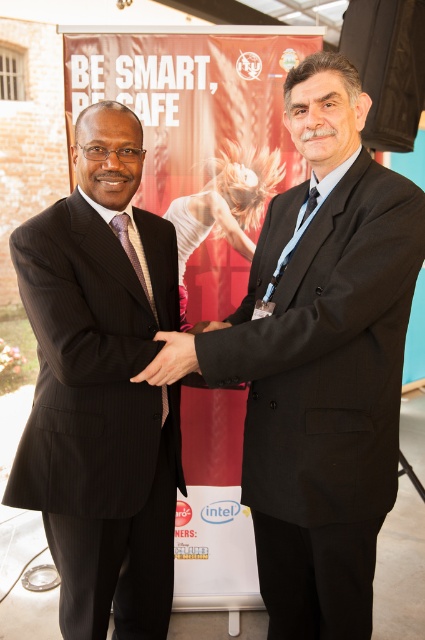
You are a photographer who needs to capture a closeup shot of both the black matte hand at center and the matte black hand at center. The camera you are using has a maximum focus range of 5 inches. Can you take a photo that includes both hands without moving the camera?

The black matte hand at center and the matte black hand at center are 5.21 inches apart. Since the distance between them exceeds the camera maximum focus range of 5 inches, you cannot take a photo that includes both hands without moving the camera.

You are a photographer trying to capture a closeup shot of the black matte suit at center and the matte black hand at center. Since the camera has a limited focus range, you need to know which object is wider to ensure proper framing. Which one is wider?

The black matte suit at center is wider than the matte black hand at center, so you should frame the shot around the black matte suit at center to ensure proper focus and composition.